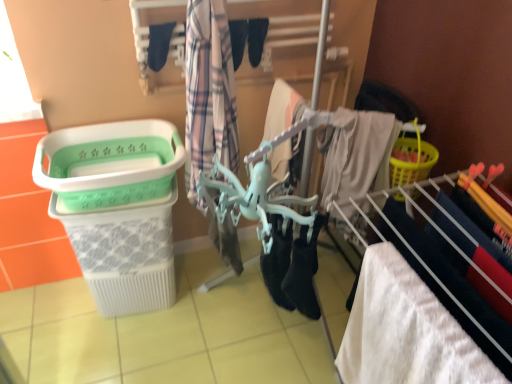
You are a GUI agent. You are given a task and a screenshot of the screen. Output one action in this format:
    pyautogui.click(x=<x>, y=<y>)
    Task: Click on the black fabric shoe at center, the 1th shoe viewed from the right
    The height and width of the screenshot is (384, 512).
    Given the screenshot: What is the action you would take?
    pyautogui.click(x=256, y=39)

What do you see at coordinates (209, 93) in the screenshot? I see `plaid fabric at center, positioned as the 2th clothing in left-to-right order` at bounding box center [209, 93].

In order to face green plastic laundry basket at left, should I rotate leftwards or rightwards?

You should look left and rotate roughly 17.919 degrees.

Image resolution: width=512 pixels, height=384 pixels. What do you see at coordinates (119, 209) in the screenshot?
I see `green plastic laundry basket at left` at bounding box center [119, 209].

Where is `green plastic laundry basket at left`? green plastic laundry basket at left is located at coordinates (119, 209).

Where is `black fabric socks at upper center, which is the 2th clothing in right-to-left order`? The height and width of the screenshot is (384, 512). black fabric socks at upper center, which is the 2th clothing in right-to-left order is located at coordinates (159, 45).

From the image's perspective, is black fabric shoe at center, the second shoe when ordered from right to left, on top of green plastic laundry basket at left?

Indeed, from the image's perspective, black fabric shoe at center, the second shoe when ordered from right to left, is shown above green plastic laundry basket at left.

In terms of width, does black fabric shoe at center, placed as the 1th shoe when sorted from left to right, look wider or thinner when compared to green plastic laundry basket at left?

black fabric shoe at center, placed as the 1th shoe when sorted from left to right, is thinner than green plastic laundry basket at left.

Is black fabric shoe at center, the second shoe when ordered from right to left, positioned in front of green plastic laundry basket at left?

No, it is not.

Does black fabric shoe at center, the 1th shoe viewed from the right, have a greater height compared to black fabric socks at upper center, placed as the first clothing when sorted from left to right?

Correct, black fabric shoe at center, the 1th shoe viewed from the right, is much taller as black fabric socks at upper center, placed as the first clothing when sorted from left to right.

Is black fabric shoe at center, the 1th shoe viewed from the right, not inside black fabric socks at upper center, which is the 2th clothing in right-to-left order?

Absolutely, black fabric shoe at center, the 1th shoe viewed from the right, is external to black fabric socks at upper center, which is the 2th clothing in right-to-left order.

This screenshot has width=512, height=384. In order to click on the 1st clothing positioned below the black fabric shoe at center, which is the 2th shoe in left-to-right order (from a real-world perspective) in this screenshot , I will do `click(159, 45)`.

From the picture: What's the angular difference between black fabric shoe at center, the 1th shoe viewed from the right, and black fabric socks at upper center, placed as the first clothing when sorted from left to right,'s facing directions?

0.000194 degrees separate the facing orientations of black fabric shoe at center, the 1th shoe viewed from the right, and black fabric socks at upper center, placed as the first clothing when sorted from left to right.

Does black fabric shoe at center, the second shoe when ordered from right to left, have a smaller size compared to black fabric socks at upper center, which is the 2th clothing in right-to-left order?

No.

Which of these two, black fabric shoe at center, placed as the 1th shoe when sorted from left to right, or black fabric socks at upper center, placed as the first clothing when sorted from left to right, stands taller?

black fabric shoe at center, placed as the 1th shoe when sorted from left to right, is taller.

Can you tell me how much black fabric shoe at center, the second shoe when ordered from right to left, and black fabric socks at upper center, placed as the first clothing when sorted from left to right, differ in facing direction?

The angular difference between black fabric shoe at center, the second shoe when ordered from right to left, and black fabric socks at upper center, placed as the first clothing when sorted from left to right, is 0.000667 degrees.

Between black fabric shoe at center, placed as the 1th shoe when sorted from left to right, and black fabric socks at upper center, which is the 2th clothing in right-to-left order, which one has larger width?

Wider between the two is black fabric shoe at center, placed as the 1th shoe when sorted from left to right.

Which of these two, black fabric shoe at center, placed as the 1th shoe when sorted from left to right, or plaid fabric at center, the first clothing when ordered from right to left, is bigger?

With larger size is plaid fabric at center, the first clothing when ordered from right to left.

How different are the orientations of black fabric shoe at center, placed as the 1th shoe when sorted from left to right, and plaid fabric at center, positioned as the 2th clothing in left-to-right order, in degrees?

The facing directions of black fabric shoe at center, placed as the 1th shoe when sorted from left to right, and plaid fabric at center, positioned as the 2th clothing in left-to-right order, are 0.807 degrees apart.

Considering their positions, is black fabric shoe at center, placed as the 1th shoe when sorted from left to right, located in front of or behind plaid fabric at center, the first clothing when ordered from right to left?

black fabric shoe at center, placed as the 1th shoe when sorted from left to right, is positioned farther from the viewer than plaid fabric at center, the first clothing when ordered from right to left.

Considering the points (229, 27) and (210, 16), which point is in front, point (229, 27) or point (210, 16)?

The point (210, 16) is closer to the camera.

Find the location of a particular element. Image resolution: width=512 pixels, height=384 pixels. basket container on the left of plaid fabric at center, the first clothing when ordered from right to left is located at coordinates (109, 163).

From a real-world perspective, is plaid fabric at center, the first clothing when ordered from right to left, on green plastic laundry basket at left?

Yes.

Looking at the image, does plaid fabric at center, positioned as the 2th clothing in left-to-right order, seem bigger or smaller compared to green plastic laundry basket at left?

Clearly, plaid fabric at center, positioned as the 2th clothing in left-to-right order, is smaller in size than green plastic laundry basket at left.

From the picture: Considering the positions of objects black fabric socks at upper center, placed as the first clothing when sorted from left to right, and green plastic laundry basket at left in the image provided, who is more to the left, black fabric socks at upper center, placed as the first clothing when sorted from left to right, or green plastic laundry basket at left?

green plastic laundry basket at left.

Measure the distance between black fabric socks at upper center, placed as the first clothing when sorted from left to right, and green plastic laundry basket at left.

The distance of black fabric socks at upper center, placed as the first clothing when sorted from left to right, from green plastic laundry basket at left is 22.23 inches.

Can you confirm if black fabric socks at upper center, which is the 2th clothing in right-to-left order, is thinner than green plastic laundry basket at left?

Correct, the width of black fabric socks at upper center, which is the 2th clothing in right-to-left order, is less than that of green plastic laundry basket at left.

Does point (153, 27) come in front of point (170, 267)?

Yes, it is in front of point (170, 267).

Between point (124, 288) and point (252, 29), which one is positioned behind?

The point (124, 288) is more distant.

Could you tell me if green plastic laundry basket at left is facing black fabric shoe at center, the 1th shoe viewed from the right?

No, green plastic laundry basket at left is not aimed at black fabric shoe at center, the 1th shoe viewed from the right.

Are green plastic laundry basket at left and black fabric shoe at center, the 1th shoe viewed from the right, beside each other?

No, green plastic laundry basket at left is not with black fabric shoe at center, the 1th shoe viewed from the right.

Is green plastic laundry basket at left situated inside black fabric shoe at center, which is the 2th shoe in left-to-right order, or outside?

green plastic laundry basket at left is spatially situated outside black fabric shoe at center, which is the 2th shoe in left-to-right order.

Where is `basket container that appears on the left of black fabric shoe at center, the second shoe when ordered from right to left`? basket container that appears on the left of black fabric shoe at center, the second shoe when ordered from right to left is located at coordinates (109, 163).

Find the location of a particular element. The image size is (512, 384). the 1st clothing in front of the black fabric shoe at center, the 1th shoe viewed from the right, counting from the anchor's position is located at coordinates (159, 45).

From the image, which object appears to be farther from white fluffy towel at lower right, black fabric socks at upper center, placed as the first clothing when sorted from left to right, or black fabric shoe at center, placed as the 1th shoe when sorted from left to right?

Among the two, black fabric socks at upper center, placed as the first clothing when sorted from left to right, is located further to white fluffy towel at lower right.

Looking at the image, which one is located closer to black fabric shoe at center, the second shoe when ordered from right to left, green plastic laundry basket at left or white fluffy towel at lower right?

green plastic laundry basket at left is closer to black fabric shoe at center, the second shoe when ordered from right to left.

When comparing their distances from white fluffy towel at lower right, does black fabric shoe at center, which is the 2th shoe in left-to-right order, or green plastic laundry basket at left seem closer?

green plastic laundry basket at left is closer to white fluffy towel at lower right.

Which object lies nearer to the anchor point black fabric socks at upper center, which is the 2th clothing in right-to-left order, green plastic laundry basket at left or black fabric shoe at center, placed as the 1th shoe when sorted from left to right?

black fabric shoe at center, placed as the 1th shoe when sorted from left to right, is positioned closer to the anchor black fabric socks at upper center, which is the 2th clothing in right-to-left order.

Considering their positions, is black fabric shoe at center, the second shoe when ordered from right to left, positioned further to plaid fabric at center, the first clothing when ordered from right to left, than green plastic laundry basket at left?

Based on the image, black fabric shoe at center, the second shoe when ordered from right to left, appears to be further to plaid fabric at center, the first clothing when ordered from right to left.

Based on the photo, looking at the image, which one is located closer to plaid fabric at center, positioned as the 2th clothing in left-to-right order, black fabric shoe at center, the 1th shoe viewed from the right, or green plastic laundry basket at left?

green plastic laundry basket at left lies closer to plaid fabric at center, positioned as the 2th clothing in left-to-right order, than the other object.

When comparing their distances from plaid fabric at center, positioned as the 2th clothing in left-to-right order, does green plastic laundry basket at left or black fabric shoe at center, the second shoe when ordered from right to left, seem closer?

black fabric shoe at center, the second shoe when ordered from right to left, is positioned closer to the anchor plaid fabric at center, positioned as the 2th clothing in left-to-right order.

Which object lies further to the anchor point green plastic laundry basket at left, black fabric shoe at center, the 1th shoe viewed from the right, or white fluffy towel at lower right?

Answer: white fluffy towel at lower right lies further to green plastic laundry basket at left than the other object.

Image resolution: width=512 pixels, height=384 pixels. Identify the location of shoe located between black fabric socks at upper center, which is the 2th clothing in right-to-left order, and black fabric shoe at center, which is the 2th shoe in left-to-right order, in the left-right direction. (238, 40).

At what (x,y) coordinates should I click in order to perform the action: click on basket container situated between green plastic laundry basket at left and white fluffy towel at lower right from left to right. Please return your answer as a coordinate pair (x, y). Looking at the image, I should click on (109, 163).

Find the location of a particular element. shopping basket between black fabric shoe at center, which is the 2th shoe in left-to-right order, and white fluffy towel at lower right, in the vertical direction is located at coordinates (119, 209).

Locate an element on the screen. The height and width of the screenshot is (384, 512). clothing between black fabric socks at upper center, placed as the first clothing when sorted from left to right, and green plastic laundry basket at left vertically is located at coordinates (209, 93).